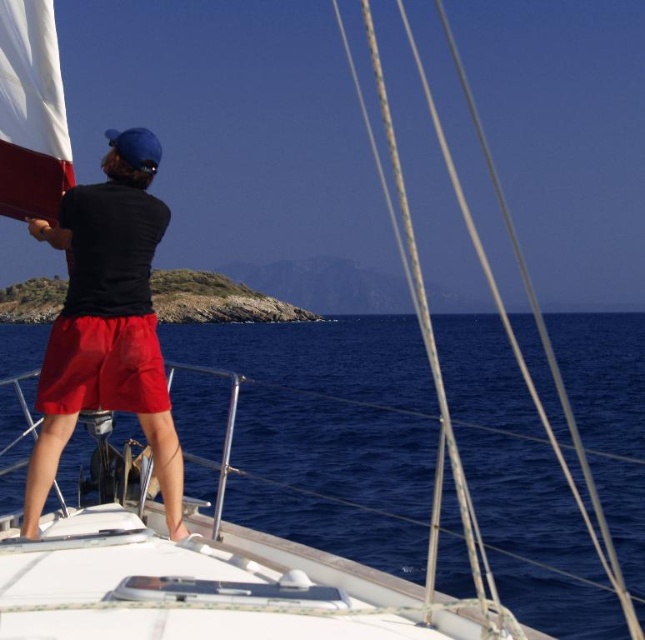
You are standing on the deck of the sailboat and want to hand a tool to the person at the bow. The tool is too heavy to throw, so you need to walk directly to them. Which object, the black matte shirt at center or the matte red shorts at center, will you reach first as you approach the person?

You will reach the black matte shirt at center first because it is closer to you than the matte red shorts at center.

You are a sailor on the deck of the boat and need to reach an item that is at the same height as the black matte shirt at center. Can you determine if the matte red shorts at center will be an obstacle in your way?

The black matte shirt at center has a greater height compared to matte red shorts at center, so the matte red shorts at center are shorter. Since the item is at the same height as the black matte shirt at center, the matte red shorts at center will not be an obstacle in your way.